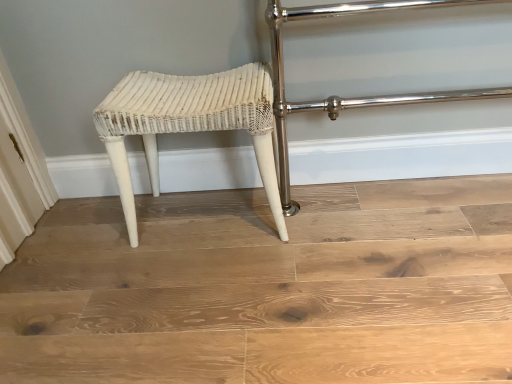
Identify the location of free space above white wicker stool at center (from a real-world perspective). (284, 248).